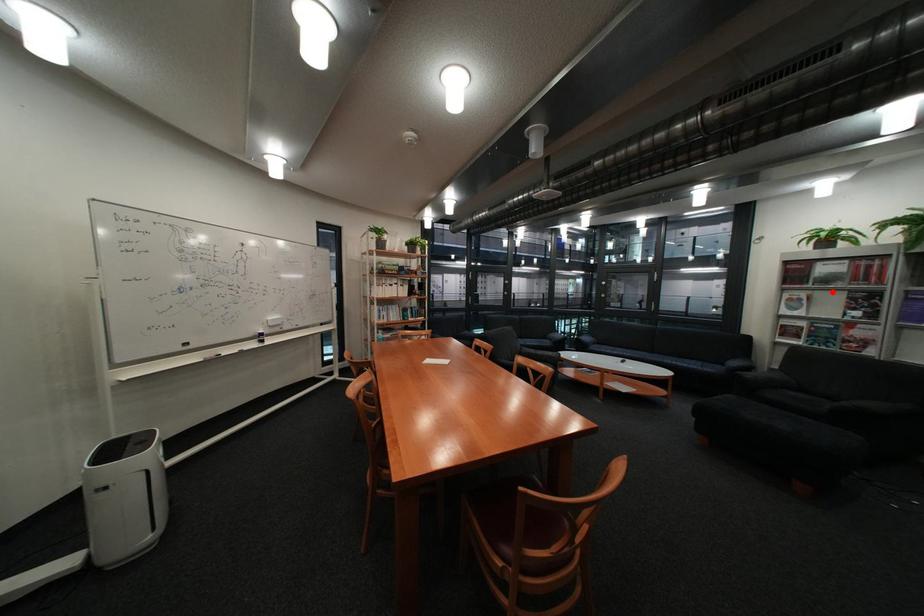
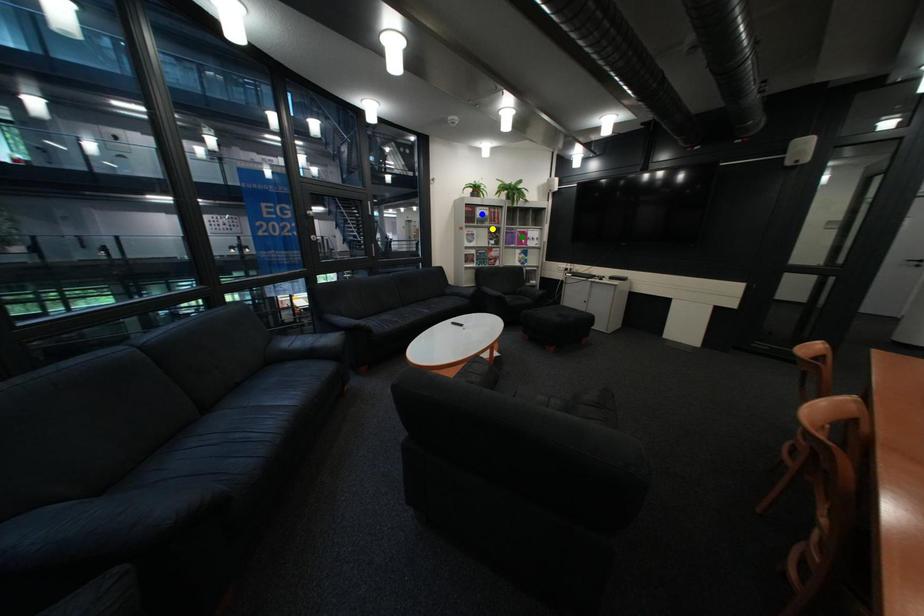
Question: I am providing you with two images of the same scene from different viewpoints. A red point is marked on the first image. You are given multiple points on the second image. Can you choose the point in image 2 that corresponds to the point in image 1?

Choices:
 (A) blue point
 (B) green point
 (C) yellow point

Answer: (C)